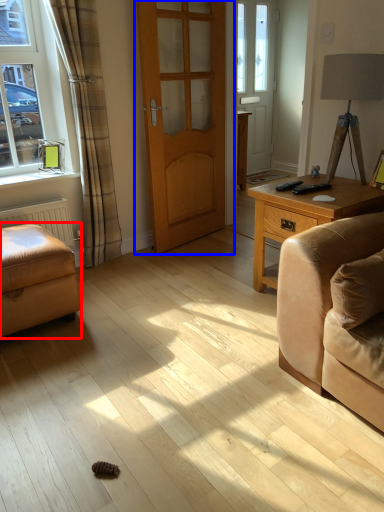
Question: Which object appears farthest to the camera in this image, armchair (highlighted by a red box) or door (highlighted by a blue box)?

Choices:
 (A) armchair
 (B) door

Answer: (B)